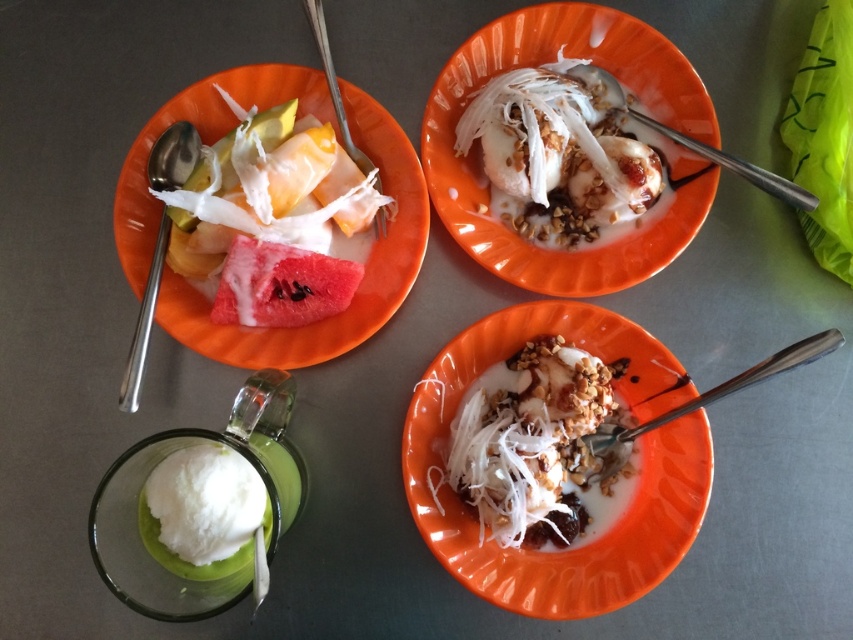
Does orange matte bowl at center have a lesser width compared to matte orange plate at upper left?

Yes.

How much distance is there between orange matte bowl at center and matte orange plate at upper left?

9.98 inches

Locate an element on the screen. orange matte bowl at center is located at coordinates (634, 476).

Locate an element on the screen. matte orange plate at upper left is located at coordinates (358, 284).

Between matte orange plate at upper left and white creamy ice cream at center, which one is positioned higher?

white creamy ice cream at center

Find the location of a particular element. matte orange plate at upper left is located at coordinates (358, 284).

Is orange matte bowl at center below white creamy dessert at center?

Yes.

Can you confirm if orange matte bowl at center is positioned to the left of white creamy dessert at center?

No, orange matte bowl at center is not to the left of white creamy dessert at center.

Does point (473, 561) lie behind point (495, 465)?

Yes, it is behind point (495, 465).

You are a GUI agent. You are given a task and a screenshot of the screen. Output one action in this format:
    pyautogui.click(x=<x>, y=<y>)
    Task: Click on the orange matte bowl at center
    The height and width of the screenshot is (640, 853).
    Given the screenshot: What is the action you would take?
    (x=634, y=476)